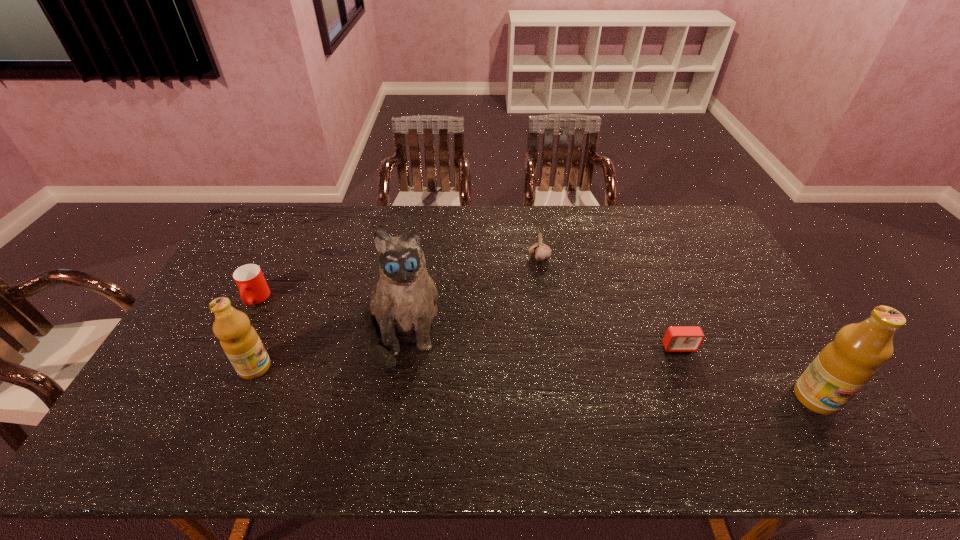
Locate an element on the screen. The height and width of the screenshot is (540, 960). unoccupied position between the alarm clock and the cat is located at coordinates (540, 339).

You are a GUI agent. You are given a task and a screenshot of the screen. Output one action in this format:
    pyautogui.click(x=<x>, y=<y>)
    Task: Click on the empty space that is in between the left olive oil and the cat
    Image resolution: width=960 pixels, height=540 pixels.
    Given the screenshot: What is the action you would take?
    tap(328, 349)

Locate an element on the screen. free space that is in between the fourth shortest object and the fourth object from right to left is located at coordinates (328, 349).

Where is `vacant space that's between the taller olive oil and the alarm clock`? This screenshot has height=540, width=960. vacant space that's between the taller olive oil and the alarm clock is located at coordinates (747, 372).

The image size is (960, 540). Find the location of `the closest object to the leftmost object`. the closest object to the leftmost object is located at coordinates (239, 340).

Where is `object that is the closest to the cup`? The height and width of the screenshot is (540, 960). object that is the closest to the cup is located at coordinates (239, 340).

Where is `vacant space that satisfies the following two spatial constraints: 1. at the face of the cat; 2. on the label of the fourth shortest object`? The width and height of the screenshot is (960, 540). vacant space that satisfies the following two spatial constraints: 1. at the face of the cat; 2. on the label of the fourth shortest object is located at coordinates (395, 368).

Where is `free space that satisfies the following two spatial constraints: 1. at the face of the third object from left to right; 2. on the label of the second object from left to right`? Image resolution: width=960 pixels, height=540 pixels. free space that satisfies the following two spatial constraints: 1. at the face of the third object from left to right; 2. on the label of the second object from left to right is located at coordinates [395, 368].

This screenshot has height=540, width=960. What are the coordinates of `free space that satisfies the following two spatial constraints: 1. on the front-facing side of the shortest object; 2. on the label of the left olive oil` in the screenshot? It's located at (687, 368).